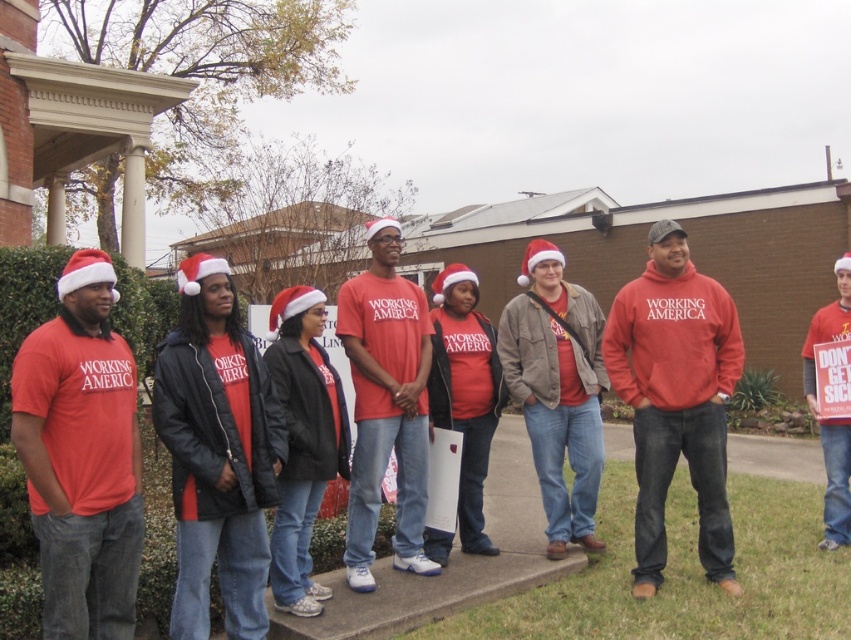
Please look at the scene described. There is a point at coordinates (x=386, y=404) in the image. Can you tell me what object is located at that point?

The point at coordinates (x=386, y=404) marks the location of the matte red shirt at center.